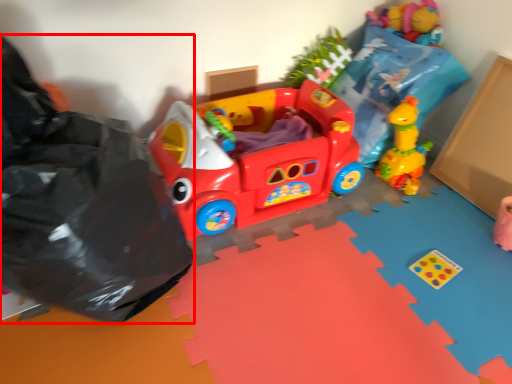
Question: From the image's perspective, what is the correct spatial relationship of garbage (annotated by the red box) in relation to toy?

Choices:
 (A) above
 (B) below

Answer: (B)